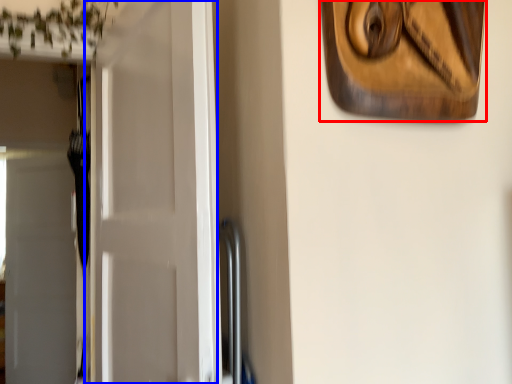
Question: Which of the following is the closest to the observer, picture frame (highlighted by a red box) or door (highlighted by a blue box)?

Choices:
 (A) picture frame
 (B) door

Answer: (A)